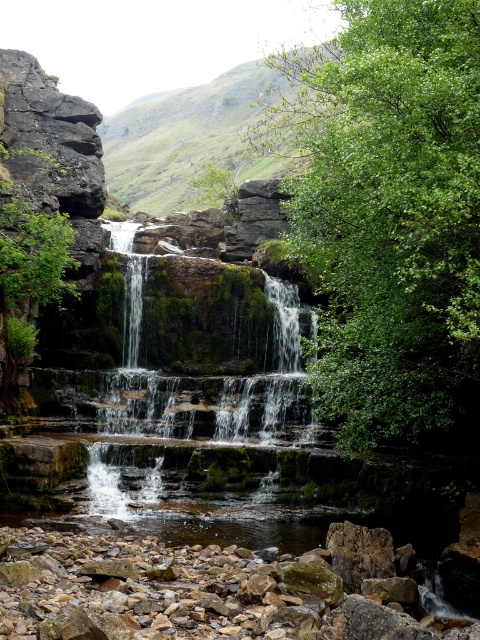
You are a hiker who wants to take a photo of the green leafy tree at center and the green mossy rock at upper center in the waterfall scene. If your camera can focus on objects within 30 meters, will both be in focus at the same time?

The green leafy tree at center is 35.08 meters from the green mossy rock at upper center. Since the distance between them exceeds the camera focus range of 30 meters, both cannot be in focus simultaneously.

You are standing at the base of the waterfall and want to take a photo of the green leafy tree at center. According to the scene description, where should you position yourself to capture the tree in the center of your camera frame?

The green leafy tree at center is located at point 0.336 on the x axis and 0.812 on the y axis, so you should position yourself at that coordinate to capture it in the center of your camera frame.

In the scene shown: You are a hiker standing at the base of the waterfall. You notice a green leafy tree at center and a green mossy rock at upper center. Which object is positioned higher in the scene?

The green mossy rock at upper center is positioned higher than the green leafy tree at center.